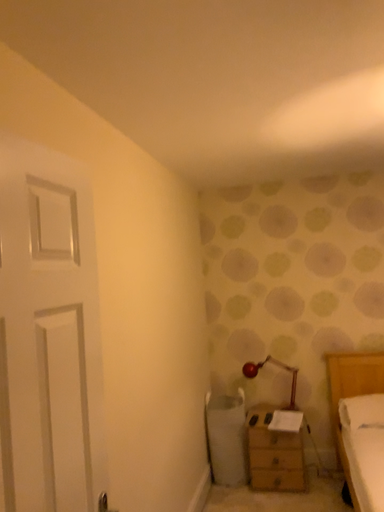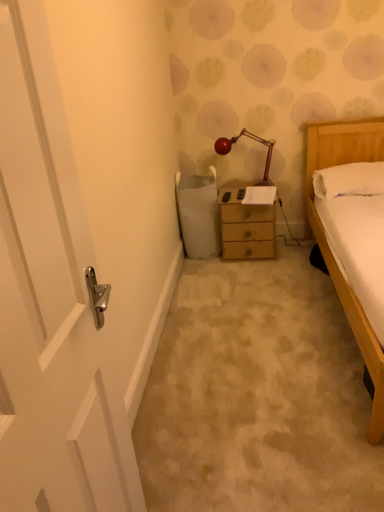
Question: How did the camera likely rotate when shooting the video?

Choices:
 (A) rotated downward
 (B) rotated upward

Answer: (A)